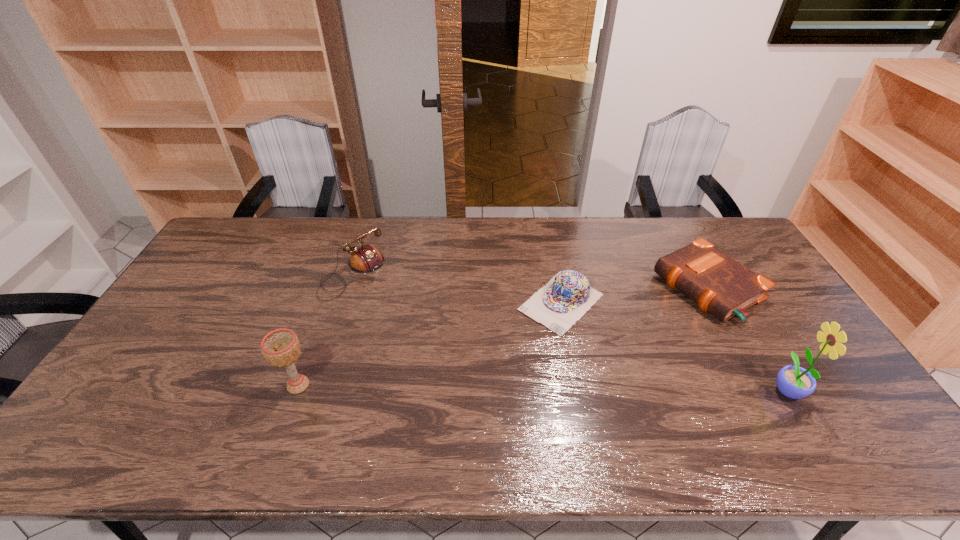
Find the location of a particular element. sunflower situated at the right edge is located at coordinates (795, 382).

The width and height of the screenshot is (960, 540). Identify the location of Bible that is at the right edge. (720, 285).

The width and height of the screenshot is (960, 540). In order to click on object located at the far right corner in this screenshot , I will do `click(720, 285)`.

Locate an element on the screen. This screenshot has height=540, width=960. object that is at the near right corner is located at coordinates (795, 382).

Locate an element on the screen. free region at the far edge is located at coordinates (439, 225).

In the image, there is a desktop. At what (x,y) coordinates should I click in order to perform the action: click on free space at the near edge. Please return your answer as a coordinate pair (x, y). The height and width of the screenshot is (540, 960). Looking at the image, I should click on (251, 397).

The image size is (960, 540). In order to click on vacant space at the left edge of the desktop in this screenshot , I will do `click(215, 258)`.

Where is `vacant space at the right edge of the desktop`? This screenshot has height=540, width=960. vacant space at the right edge of the desktop is located at coordinates (756, 330).

I want to click on free point at the near right corner, so click(845, 406).

Where is `vacant area that lies between the fourth shortest object and the Bible`? vacant area that lies between the fourth shortest object and the Bible is located at coordinates (503, 336).